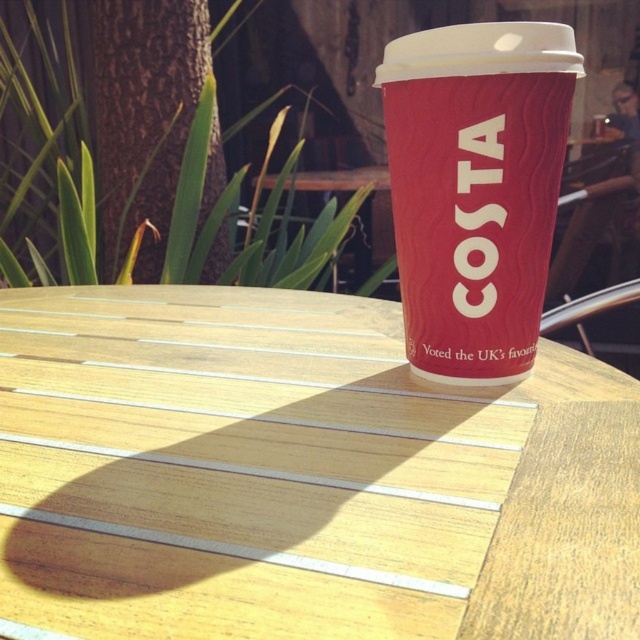
Is point (192, 461) less distant than point (464, 24)?

Yes, point (192, 461) is in front of point (464, 24).

I want to click on wooden table at center, so click(x=300, y=476).